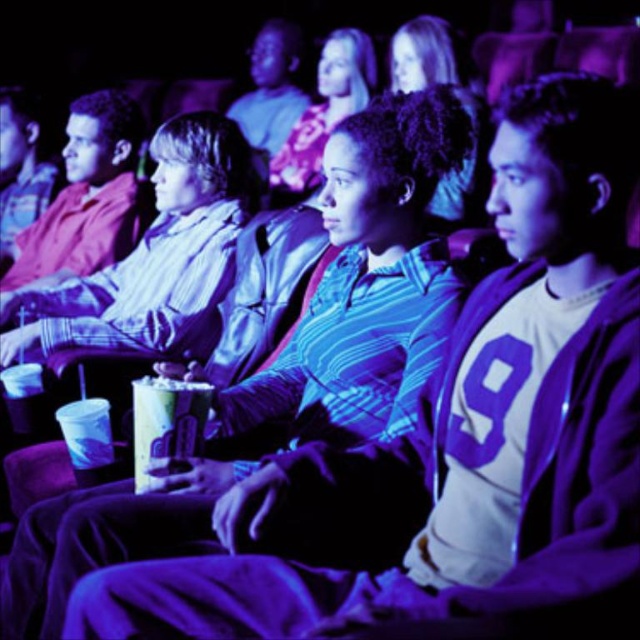
Question: Which point is farther to the camera?

Choices:
 (A) (172, 416)
 (B) (65, 509)

Answer: (A)

Question: Which point is closer to the camera?

Choices:
 (A) (168, 456)
 (B) (410, 179)

Answer: (A)

Question: Which object is positioned closest to the translucent plastic cup at center?

Choices:
 (A) matte blue shirt at center
 (B) striped cotton shirt at center

Answer: (B)

Question: Can you confirm if striped cotton shirt at center is thinner than translucent plastic cup at center?

Choices:
 (A) no
 (B) yes

Answer: (A)

Question: Can you confirm if matte blue shirt at center is positioned to the left of translucent plastic cup at center?

Choices:
 (A) yes
 (B) no

Answer: (B)

Question: From the image, what is the correct spatial relationship of striped cotton shirt at center in relation to matte blue shirt at center?

Choices:
 (A) right
 (B) left

Answer: (B)